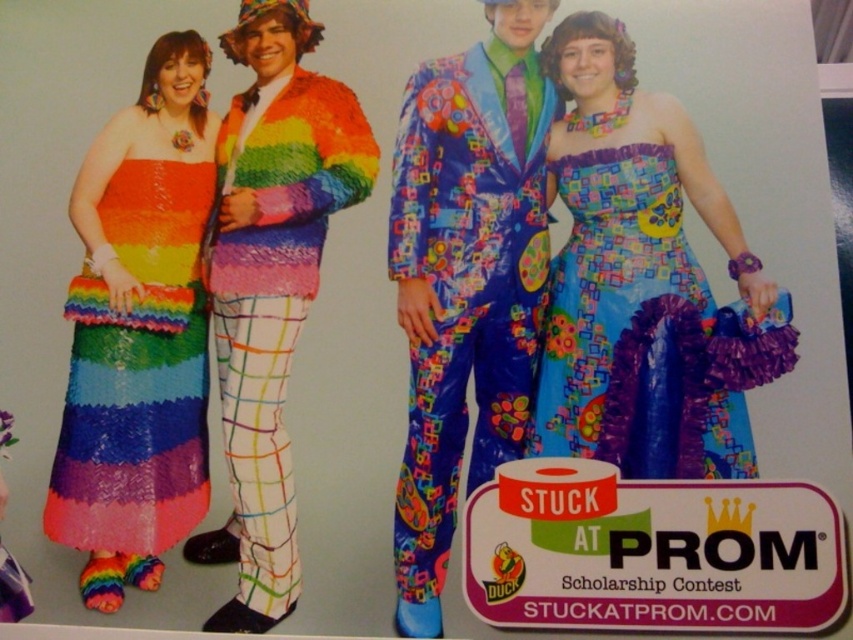
Based on the photo, does shiny plastic suit at center have a smaller size compared to rainbow sequined suit at center?

Incorrect, shiny plastic suit at center is not smaller in size than rainbow sequined suit at center.

Locate an element on the screen. This screenshot has width=853, height=640. shiny plastic suit at center is located at coordinates (466, 280).

Measure the distance from multicolored fabric dress at center to rainbow sequined suit at center.

multicolored fabric dress at center is 17.81 inches from rainbow sequined suit at center.

Which is more to the left, multicolored fabric dress at center or rainbow sequined suit at center?

Positioned to the left is rainbow sequined suit at center.

Is point (628, 230) in front of point (357, 156)?

Yes, it is.

I want to click on multicolored fabric dress at center, so pyautogui.click(x=642, y=280).

Is multicolored fabric dress at center positioned behind shiny plastic suit at center?

Yes, it is behind shiny plastic suit at center.

Does multicolored fabric dress at center have a smaller size compared to shiny plastic suit at center?

Yes, multicolored fabric dress at center is smaller than shiny plastic suit at center.

The height and width of the screenshot is (640, 853). Describe the element at coordinates (642, 280) in the screenshot. I see `multicolored fabric dress at center` at that location.

Locate an element on the screen. multicolored fabric dress at center is located at coordinates (642, 280).